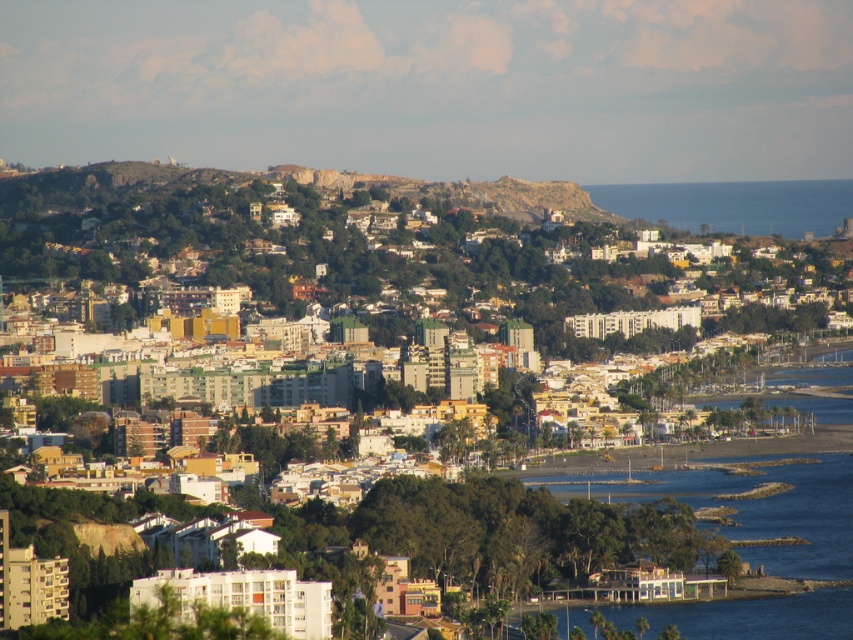
Which is below, multicolored buildings at center or blue water at right?

multicolored buildings at center

Find the location of `multicolored buildings at center`. multicolored buildings at center is located at coordinates (498, 531).

Does point (144, 364) come in front of point (784, 224)?

That is True.

Image resolution: width=853 pixels, height=640 pixels. I want to click on multicolored buildings at center, so click(x=498, y=531).

Does blue water at lower right have a larger size compared to blue water at right?

Yes, blue water at lower right is bigger than blue water at right.

Between point (831, 456) and point (799, 212), which one is positioned behind?

Point (831, 456)

Is point (796, 490) closer to camera compared to point (790, 193)?

Yes, it is in front of point (790, 193).

The width and height of the screenshot is (853, 640). In order to click on blue water at lower right in this screenshot , I will do `click(749, 508)`.

This screenshot has height=640, width=853. What do you see at coordinates (498, 531) in the screenshot?
I see `multicolored buildings at center` at bounding box center [498, 531].

Looking at this image, does multicolored buildings at center appear over blue water at lower right?

Indeed, multicolored buildings at center is positioned over blue water at lower right.

Does point (521, 401) lie behind point (782, 500)?

No, (521, 401) is closer to viewer.

Locate an element on the screen. multicolored buildings at center is located at coordinates (498, 531).